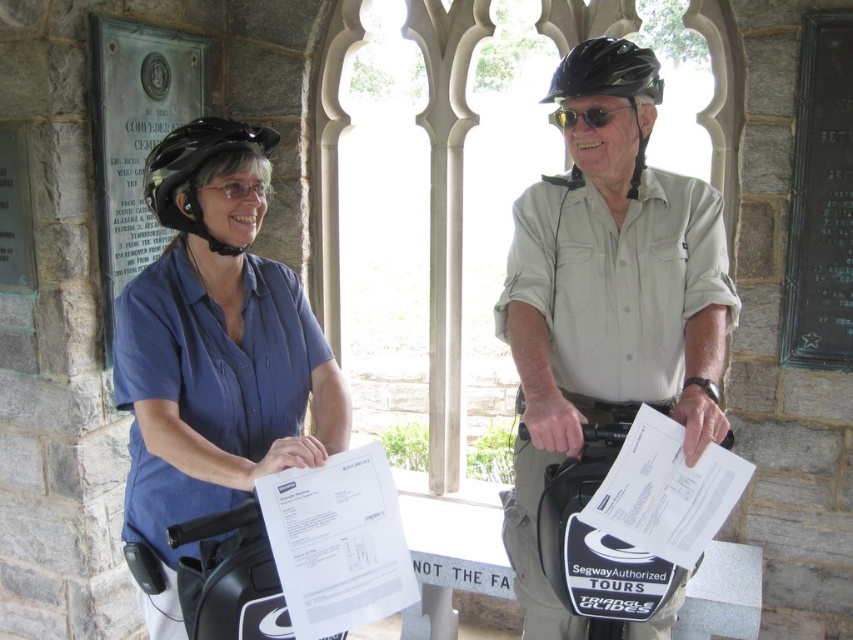
Between matte blue shirt at center and black reflective sunglasses at upper center, which one is positioned lower?

matte blue shirt at center is lower down.

Can you confirm if matte blue shirt at center is bigger than black reflective sunglasses at upper center?

Correct, matte blue shirt at center is larger in size than black reflective sunglasses at upper center.

The image size is (853, 640). Describe the element at coordinates (213, 355) in the screenshot. I see `matte blue shirt at center` at that location.

Locate an element on the screen. matte blue shirt at center is located at coordinates (213, 355).

Can you confirm if matte blue shirt at center is positioned to the right of black matte helmet at upper left?

Indeed, matte blue shirt at center is positioned on the right side of black matte helmet at upper left.

Is point (234, 339) closer to viewer compared to point (167, 212)?

No.

What do you see at coordinates (213, 355) in the screenshot? The width and height of the screenshot is (853, 640). I see `matte blue shirt at center` at bounding box center [213, 355].

Identify the location of matte blue shirt at center. The image size is (853, 640). (213, 355).

Is the position of black matte helmet at upper left more distant than that of black matte helmet at upper center?

Yes, it is.

Between black matte helmet at upper left and black matte helmet at upper center, which one is positioned lower?

black matte helmet at upper left is below.

Locate an element on the screen. black matte helmet at upper left is located at coordinates (196, 170).